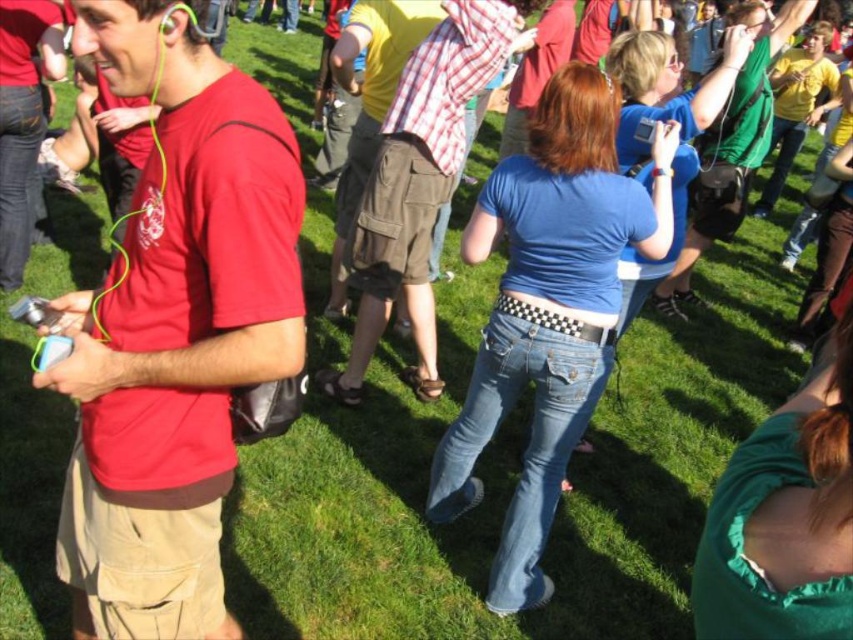
You are standing at point (173, 330) in the image. What object is located exactly at this point?

The matte red t shirt at left is located exactly at point (173, 330).